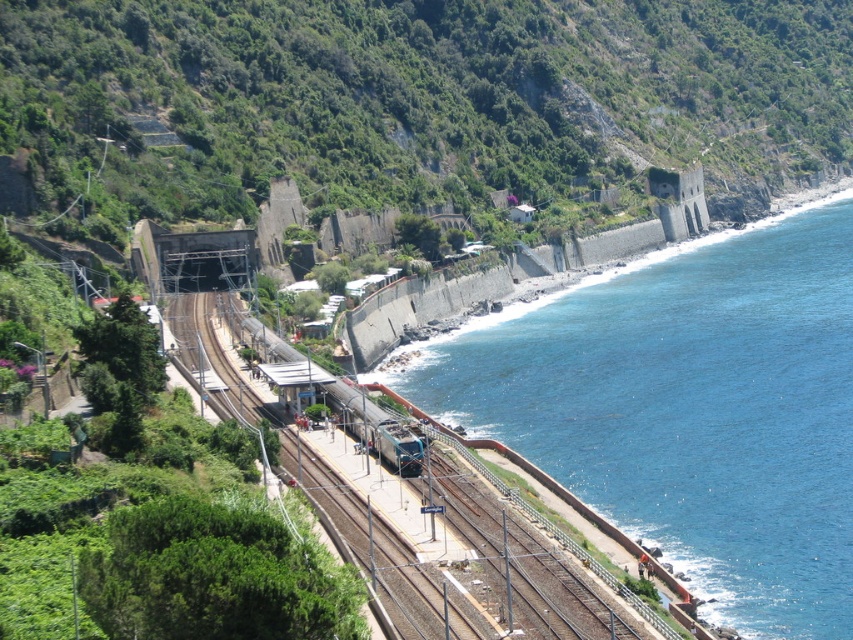
Question: Which point appears closest to the camera in this image?

Choices:
 (A) (346, 385)
 (B) (590, 284)

Answer: (A)

Question: Can you confirm if brown gravel track at center is smaller than metallic blue train at center?

Choices:
 (A) yes
 (B) no

Answer: (B)

Question: Which object is farther from the camera taking this photo?

Choices:
 (A) metallic blue train at center
 (B) blue water at lower right
 (C) brown gravel track at center

Answer: (A)

Question: In this image, where is brown gravel track at center located relative to metallic blue train at center?

Choices:
 (A) below
 (B) above

Answer: (B)

Question: Which of the following is the closest to the observer?

Choices:
 (A) brown gravel track at center
 (B) metallic blue train at center

Answer: (A)

Question: Does blue water at lower right appear over brown gravel track at center?

Choices:
 (A) no
 (B) yes

Answer: (B)